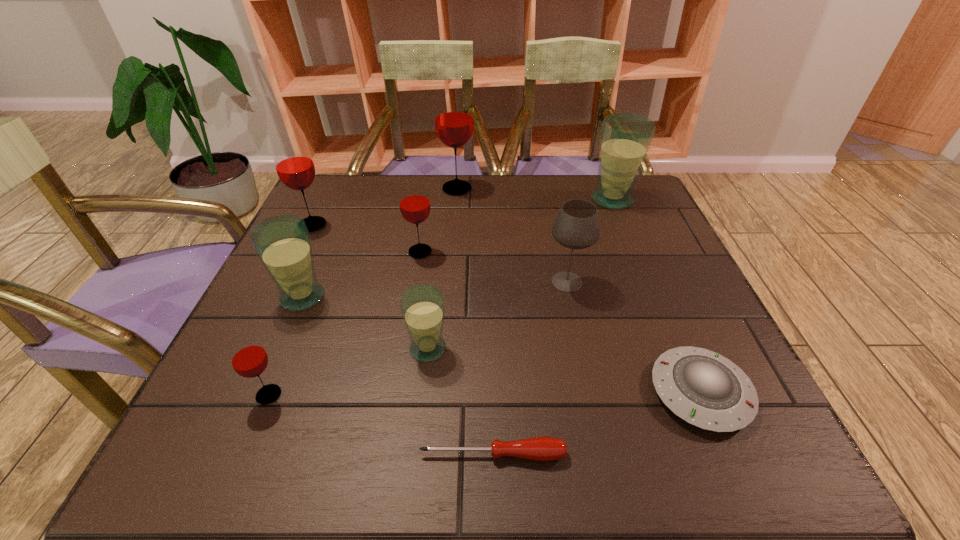
What are the coordinates of `the leftmost blue glass` in the screenshot? It's located at (282, 243).

This screenshot has height=540, width=960. Find the location of `the second farthest blue glass`. the second farthest blue glass is located at coordinates (282, 243).

Image resolution: width=960 pixels, height=540 pixels. I want to click on the second blue glass from right to left, so click(x=422, y=306).

At what (x,y) coordinates should I click in order to perform the action: click on the sixth farthest glass. Please return your answer as a coordinate pair (x, y). Looking at the image, I should click on (422, 306).

This screenshot has width=960, height=540. What are the coordinates of `the nearest red glass` in the screenshot? It's located at (249, 359).

Where is `the nearest glass`? This screenshot has width=960, height=540. the nearest glass is located at coordinates (249, 359).

At what (x,y) coordinates should I click in order to perform the action: click on the second shortest object. Please return your answer as a coordinate pair (x, y). Image resolution: width=960 pixels, height=540 pixels. Looking at the image, I should click on (705, 389).

This screenshot has width=960, height=540. I want to click on red screwdriver, so click(538, 448).

You are a GUI agent. You are given a task and a screenshot of the screen. Output one action in this format:
    pyautogui.click(x=<x>, y=<y>)
    Task: Click on the screwdriver
    The height and width of the screenshot is (540, 960).
    Given the screenshot: What is the action you would take?
    pyautogui.click(x=538, y=448)

Locate an element on the screen. vacant space situated 0.160m on the front of the farthest red glass is located at coordinates (454, 232).